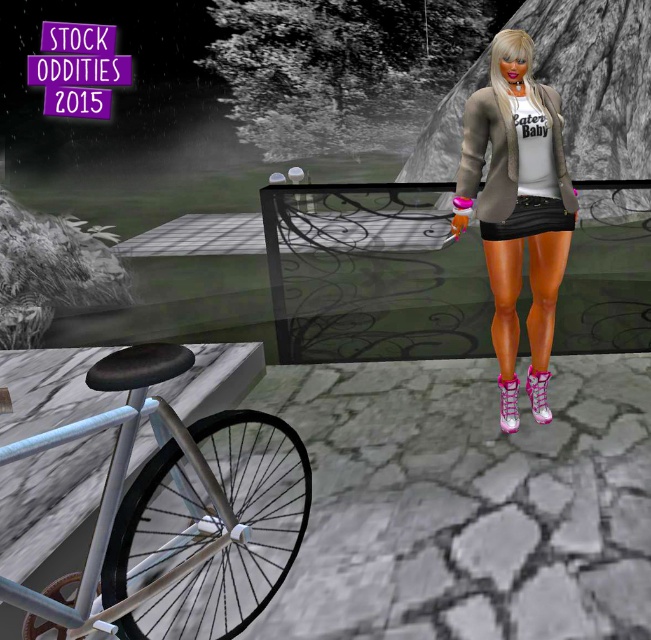
You are a photographer trying to capture the black matte skirt at center and the silver metallic bicycle at lower left in the same frame. Which object will appear larger in your photo?

The silver metallic bicycle at lower left will appear larger in the photo because it is closer to the viewer than the black matte skirt at center.

You are standing at the center of the paved area and want to move towards the silver metallic bicycle at lower left. Which direction should you move in?

The silver metallic bicycle at lower left is located at point 0.805 on the x axis and 0.267 on the y axis, so you should move towards the lower left direction to reach it.